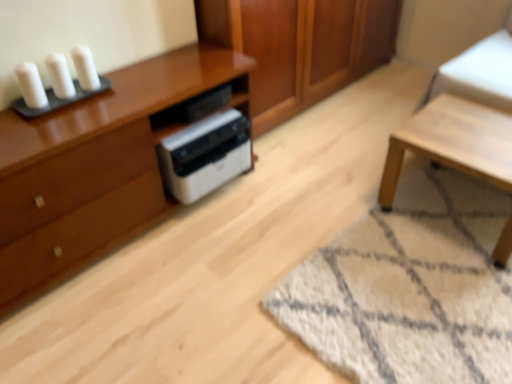
Question: Considering the positions of matte brown cabinet at left and white matte candle at upper left, the third candle viewed from the left, in the image, is matte brown cabinet at left bigger or smaller than white matte candle at upper left, the third candle viewed from the left,?

Choices:
 (A) big
 (B) small

Answer: (A)

Question: Does point (133, 203) appear closer or farther from the camera than point (93, 71)?

Choices:
 (A) farther
 (B) closer

Answer: (A)

Question: Considering the real-world distances, which object is closest to the white matte candle at upper left, arranged as the 2th candle when viewed from the right?

Choices:
 (A) matte brown cabinet at left
 (B) white plastic printer at center
 (C) white matte candle at upper left, the third candle viewed from the left
 (D) wooden cabinet at center
 (E) white plastic printer at center

Answer: (C)

Question: Which object is positioned closest to the white plastic printer at center?

Choices:
 (A) white matte candle at upper left, arranged as the 2th candle when viewed from the right
 (B) white matte candle at upper left, marked as the 1th candle in a right-to-left arrangement
 (C) matte brown cabinet at left
 (D) light wood table at lower right
 (E) white plastic printer at center

Answer: (E)